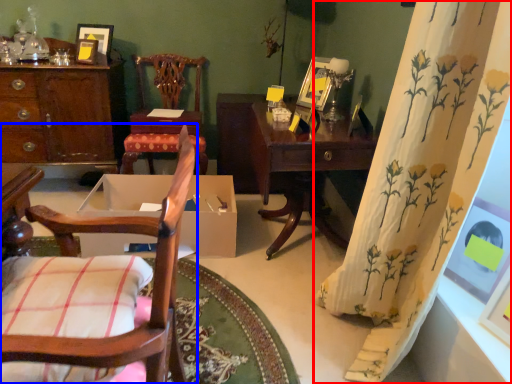
Question: Among these objects, which one is farthest to the camera, curtain (highlighted by a red box) or chair (highlighted by a blue box)?

Choices:
 (A) curtain
 (B) chair

Answer: (A)